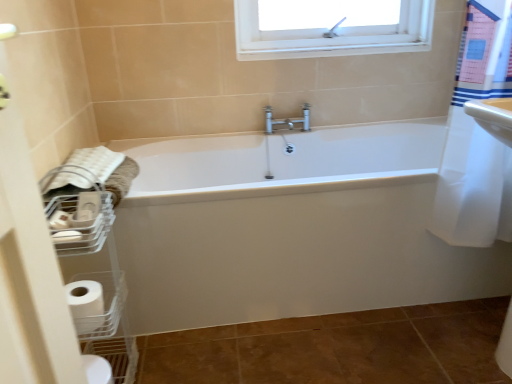
Question: Is white plastic basket at lower left positioned with its back to brown matte ceramic tile at lower center?

Choices:
 (A) yes
 (B) no

Answer: (B)

Question: From the image's perspective, is white plastic basket at lower left under brown matte ceramic tile at lower center?

Choices:
 (A) no
 (B) yes

Answer: (A)

Question: Could you tell me if white plastic basket at lower left is facing brown matte ceramic tile at lower center?

Choices:
 (A) yes
 (B) no

Answer: (A)

Question: Considering the relative sizes of white plastic basket at lower left and brown matte ceramic tile at lower center in the image provided, is white plastic basket at lower left shorter than brown matte ceramic tile at lower center?

Choices:
 (A) yes
 (B) no

Answer: (B)

Question: From the image's perspective, does white plastic basket at lower left appear higher than brown matte ceramic tile at lower center?

Choices:
 (A) no
 (B) yes

Answer: (B)

Question: Does white plastic basket at lower left have a greater height compared to brown matte ceramic tile at lower center?

Choices:
 (A) yes
 (B) no

Answer: (A)

Question: Could you tell me if white matte toilet paper at lower left is facing brown matte ceramic tile at lower center?

Choices:
 (A) yes
 (B) no

Answer: (B)

Question: Is white matte toilet paper at lower left to the right of brown matte ceramic tile at lower center from the viewer's perspective?

Choices:
 (A) no
 (B) yes

Answer: (A)

Question: Does white matte toilet paper at lower left have a larger size compared to brown matte ceramic tile at lower center?

Choices:
 (A) yes
 (B) no

Answer: (B)

Question: From a real-world perspective, is white matte toilet paper at lower left on brown matte ceramic tile at lower center?

Choices:
 (A) no
 (B) yes

Answer: (B)

Question: Is white matte toilet paper at lower left closer to the viewer compared to brown matte ceramic tile at lower center?

Choices:
 (A) yes
 (B) no

Answer: (A)

Question: Can you confirm if white matte toilet paper at lower left is smaller than brown matte ceramic tile at lower center?

Choices:
 (A) yes
 (B) no

Answer: (A)

Question: From a real-world perspective, is white soft towel at left beneath white plastic basket at lower left?

Choices:
 (A) yes
 (B) no

Answer: (B)